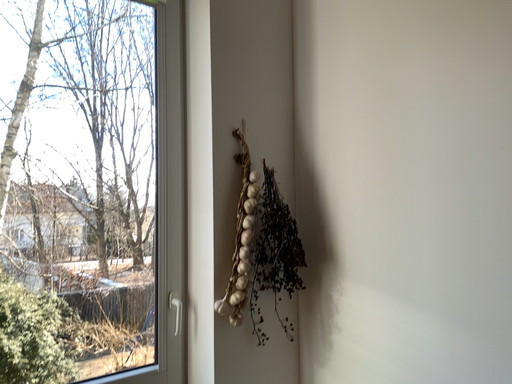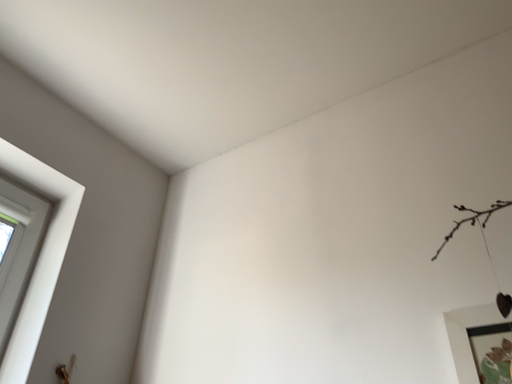
Question: Which way did the camera rotate in the video?

Choices:
 (A) rotated left
 (B) rotated right

Answer: (B)